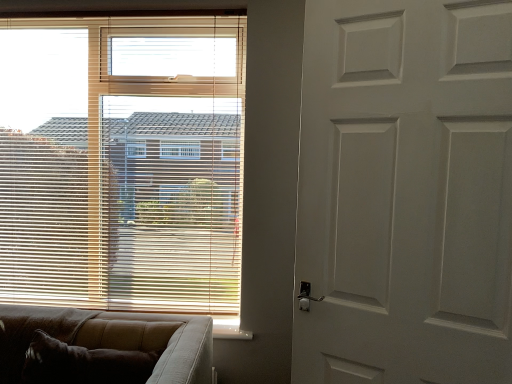
Question: Is point (86, 142) positioned closer to the camera than point (190, 349)?

Choices:
 (A) farther
 (B) closer

Answer: (A)

Question: In the image, is wooden blinds at upper left positioned in front of or behind brown textured couch at lower left?

Choices:
 (A) front
 (B) behind

Answer: (B)

Question: Which object is positioned farthest from the wooden blinds at upper left?

Choices:
 (A) brown textured couch at lower left
 (B) white matte door at right

Answer: (B)

Question: Which object is the closest to the brown textured couch at lower left?

Choices:
 (A) white matte door at right
 (B) wooden blinds at upper left

Answer: (B)